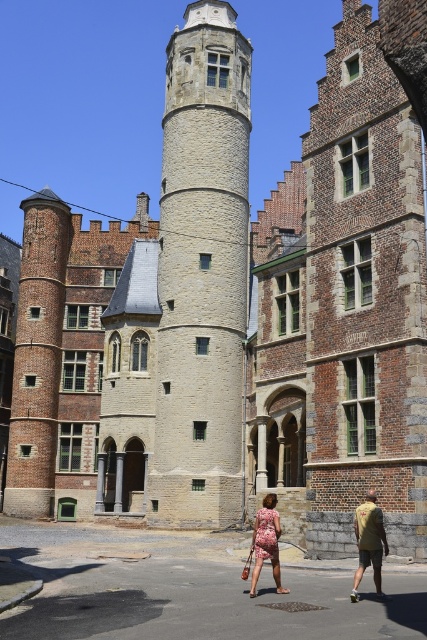
Question: Observing the image, what is the correct spatial positioning of light gray stone tower at center in reference to floral dress at center?

Choices:
 (A) below
 (B) above

Answer: (B)

Question: Is khaki cotton shirt at lower right smaller than floral dress at center?

Choices:
 (A) no
 (B) yes

Answer: (B)

Question: Among these objects, which one is nearest to the camera?

Choices:
 (A) khaki cotton shirt at lower right
 (B) floral dress at center
 (C) light gray stone tower at center

Answer: (A)

Question: Is light gray stone tower at center closer to the viewer compared to floral dress at center?

Choices:
 (A) yes
 (B) no

Answer: (B)

Question: Which object is the closest to the khaki cotton shirt at lower right?

Choices:
 (A) light gray stone tower at center
 (B) floral dress at center

Answer: (B)

Question: Among these points, which one is nearest to the camera?

Choices:
 (A) (360, 561)
 (B) (178, 125)
 (C) (257, 557)

Answer: (A)